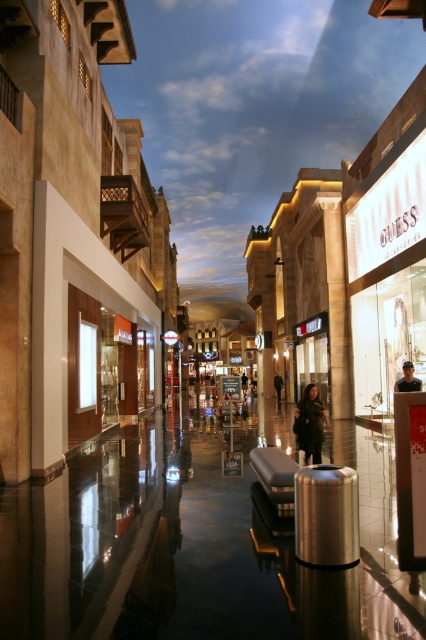
Question: Which of the following is the closest to the observer?

Choices:
 (A) dark brown leather jacket at center
 (B) dark green leather jacket at center

Answer: (B)

Question: Where is dark green leather jacket at center located in relation to dark brown leather jacket at center in the image?

Choices:
 (A) left
 (B) right

Answer: (A)

Question: Which point is farther from the camera taking this photo?

Choices:
 (A) (408, 372)
 (B) (307, 394)

Answer: (A)

Question: Which object is closer to the camera taking this photo?

Choices:
 (A) dark green leather jacket at center
 (B) light brown leather jacket at center
 (C) dark brown leather jacket at center

Answer: (A)

Question: Is light brown leather jacket at center further to the viewer compared to dark brown leather jacket at center?

Choices:
 (A) no
 (B) yes

Answer: (A)

Question: Is dark green leather jacket at center above dark brown leather jacket at center?

Choices:
 (A) no
 (B) yes

Answer: (B)